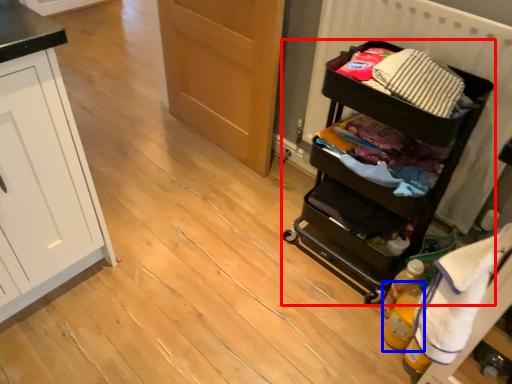
Question: Which point is closer to the camera, furniture (highlighted by a red box) or bottle (highlighted by a blue box)?

Choices:
 (A) furniture
 (B) bottle

Answer: (A)